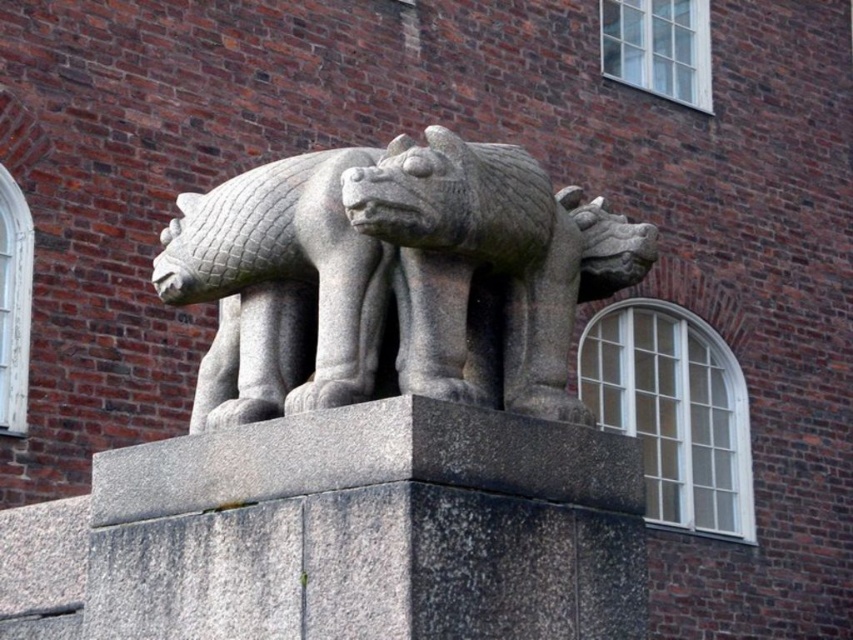
Question: Does gray stone statue at center have a lesser width compared to gray stone lion at center?

Choices:
 (A) yes
 (B) no

Answer: (B)

Question: Which of the following is the closest to the observer?

Choices:
 (A) gray stone lion at center
 (B) gray stone statue at center

Answer: (B)

Question: Does gray stone statue at center have a larger size compared to gray stone lion at center?

Choices:
 (A) no
 (B) yes

Answer: (B)

Question: From the image, what is the correct spatial relationship of gray stone statue at center in relation to gray stone lion at center?

Choices:
 (A) right
 (B) left

Answer: (A)